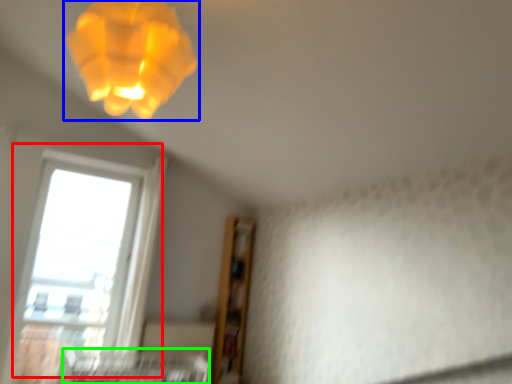
Question: Estimate the real-world distances between objects in this image. Which object is farther from window (highlighted by a red box), lamp (highlighted by a blue box) or bed frame (highlighted by a green box)?

Choices:
 (A) lamp
 (B) bed frame

Answer: (A)